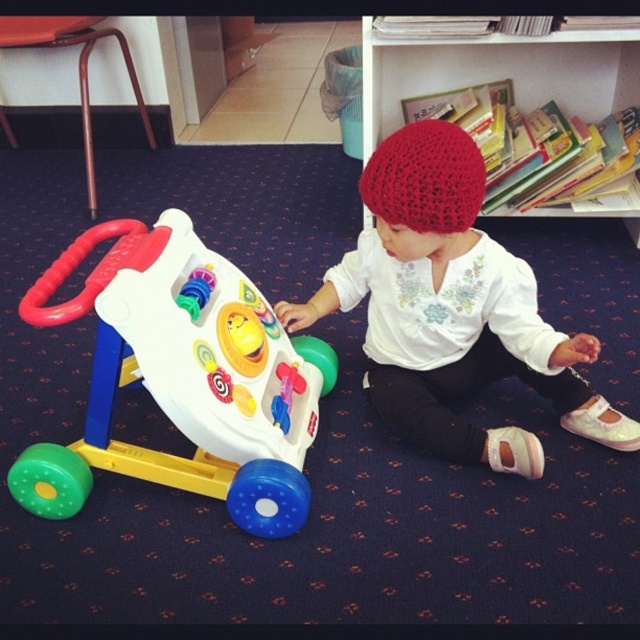
Question: Does plastic walker at left have a greater width compared to wooden bookshelf at upper center?

Choices:
 (A) yes
 (B) no

Answer: (B)

Question: Which of the following is the farthest from the observer?

Choices:
 (A) (556, 214)
 (B) (396, 132)

Answer: (A)

Question: Where is white matte shirt at center located in relation to crochet red hat at center in the image?

Choices:
 (A) left
 (B) right

Answer: (B)

Question: Based on their relative distances, which object is nearer to the crochet red hat at center?

Choices:
 (A) wooden bookshelf at upper center
 (B) white matte shirt at center
 (C) plastic walker at left

Answer: (B)

Question: Which point is farther from the camera taking this photo?

Choices:
 (A) (442, 148)
 (B) (512, 67)
 (C) (184, 282)
 (D) (372, 236)

Answer: (B)

Question: From the image, what is the correct spatial relationship of white matte shirt at center in relation to wooden bookshelf at upper center?

Choices:
 (A) right
 (B) left

Answer: (B)